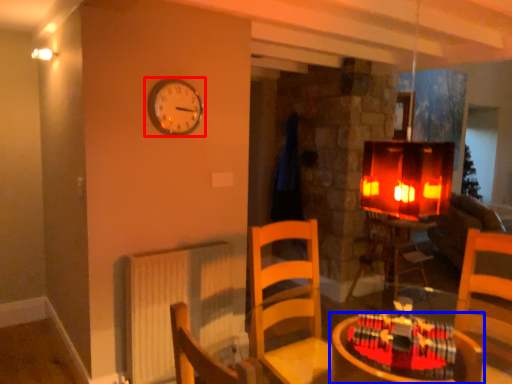
Question: Which of the following is the farthest to the observer, wall clock (highlighted by a red box) or table (highlighted by a blue box)?

Choices:
 (A) wall clock
 (B) table

Answer: (A)